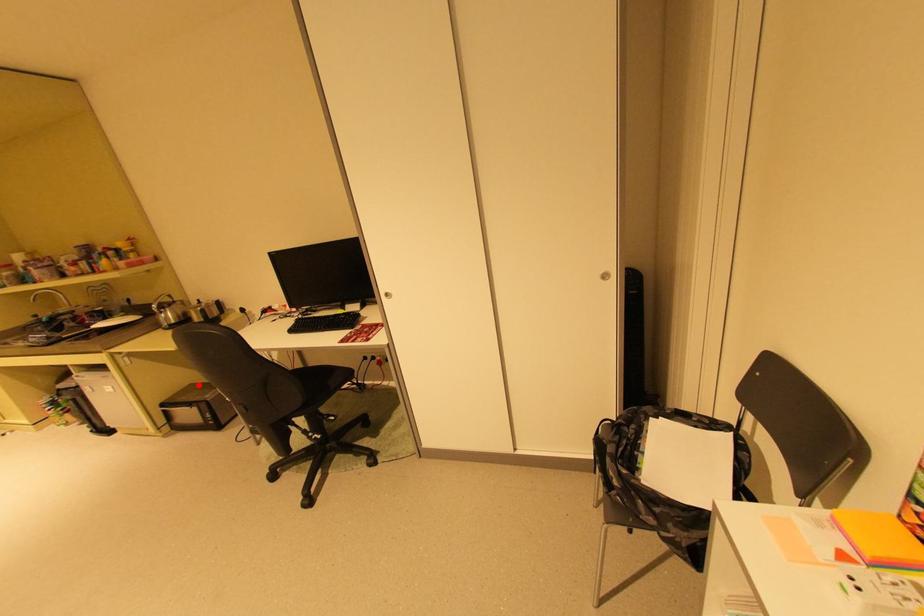
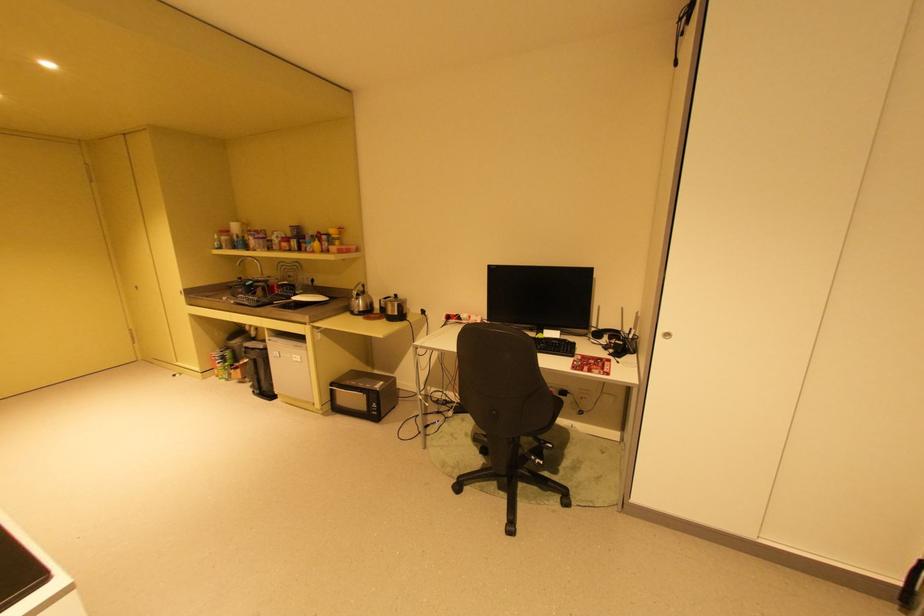
Question: A red point is marked in image1. In image2, is the corresponding 3D point closer to the camera or farther? Reply with the corresponding letter.

Choices:
 (A) The corresponding 3D point is closer.
 (B) The corresponding 3D point is farther.

Answer: (A)